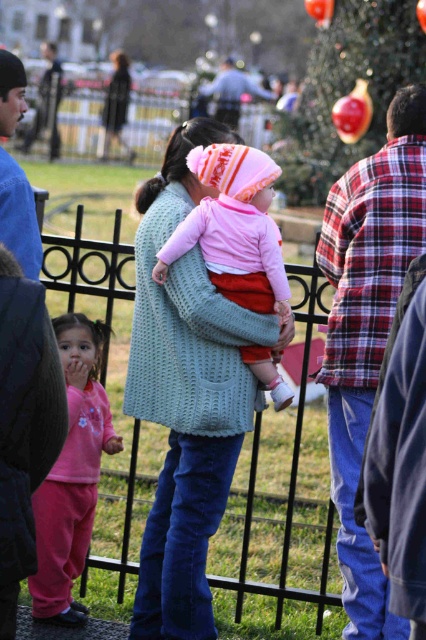
Question: Can you confirm if knitted light blue sweater at center is bigger than matte pink sweater at center?

Choices:
 (A) no
 (B) yes

Answer: (B)

Question: Considering the real-world distances, which object is farthest from the pink fleece pants at lower left?

Choices:
 (A) knitted light blue sweater at center
 (B) matte pink sweater at center

Answer: (B)

Question: Is knitted light blue sweater at center bigger than pink fleece pants at lower left?

Choices:
 (A) yes
 (B) no

Answer: (A)

Question: Which of the following is the closest to the observer?

Choices:
 (A) (60, 611)
 (B) (253, 342)

Answer: (B)

Question: Among these objects, which one is farthest from the camera?

Choices:
 (A) knitted light blue sweater at center
 (B) pink fleece pants at lower left

Answer: (B)

Question: Where is knitted light blue sweater at center located in relation to matte pink sweater at center in the image?

Choices:
 (A) below
 (B) above

Answer: (A)